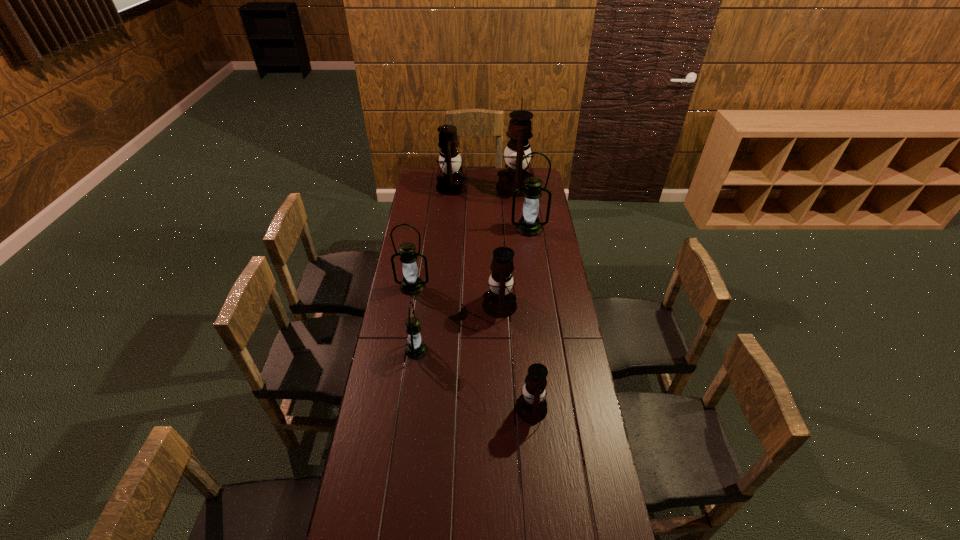
Where is `blank area located 0.260m on the side of the smallest brown lantern, there is a wick adjustment knob`? blank area located 0.260m on the side of the smallest brown lantern, there is a wick adjustment knob is located at coordinates (443, 409).

You are a GUI agent. You are given a task and a screenshot of the screen. Output one action in this format:
    pyautogui.click(x=<x>, y=<y>)
    Task: Click on the vacant area situated 0.370m on the side of the smallest brown lantern, there is a wick adjustment knob
    The height and width of the screenshot is (540, 960).
    Given the screenshot: What is the action you would take?
    pyautogui.click(x=413, y=409)

Where is `free spot located on the side of the smallest brown lantern, there is a wick adjustment knob`? free spot located on the side of the smallest brown lantern, there is a wick adjustment knob is located at coordinates (429, 409).

Find the location of a particular element. Image resolution: width=960 pixels, height=540 pixels. free location located 0.230m on the side where the second nearest object emits light is located at coordinates (485, 350).

In order to click on object that is at the far left corner in this screenshot , I will do `click(452, 182)`.

This screenshot has width=960, height=540. Identify the location of object present at the far right corner. (519, 130).

In the image, there is a desktop. Where is `vacant space at the left edge`? vacant space at the left edge is located at coordinates (406, 410).

The width and height of the screenshot is (960, 540). Identify the location of vacant space at the right edge of the desktop. (557, 327).

Locate an element on the screen. This screenshot has height=540, width=960. vacant region at the far left corner is located at coordinates (420, 181).

Identify the location of empty space that is in between the second smallest green lantern and the rightmost green lantern. This screenshot has width=960, height=540. (470, 258).